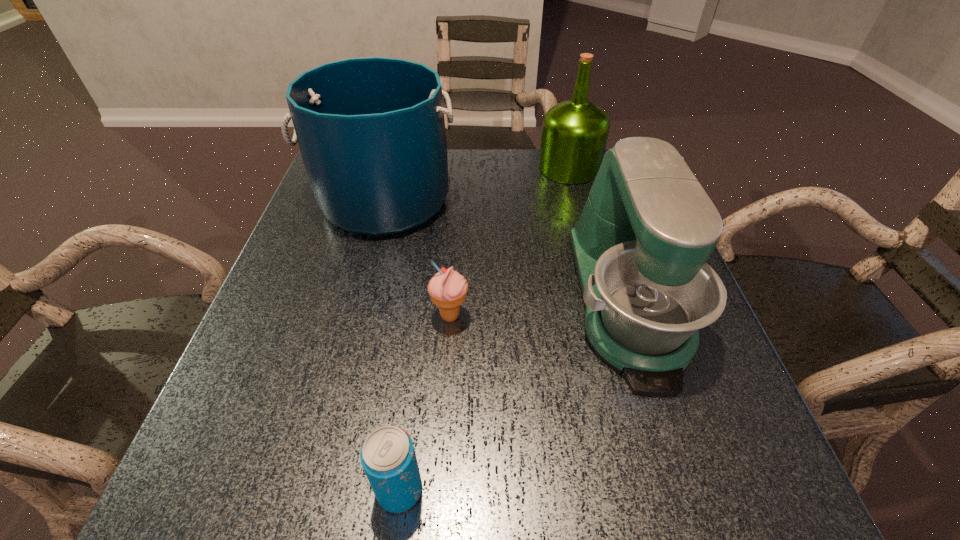
This screenshot has height=540, width=960. I want to click on olive oil that is at the far edge, so click(x=574, y=134).

The width and height of the screenshot is (960, 540). I want to click on bucket located at the far edge, so click(x=371, y=131).

Identify the location of object that is at the near edge. The height and width of the screenshot is (540, 960). click(388, 457).

The width and height of the screenshot is (960, 540). Find the location of `object situated at the left edge`. object situated at the left edge is located at coordinates (371, 131).

At what (x,y) coordinates should I click in order to perform the action: click on olive oil that is at the right edge. Please return your answer as a coordinate pair (x, y). Looking at the image, I should click on (574, 134).

Find the location of `mixer at the right edge`. mixer at the right edge is located at coordinates (640, 247).

The height and width of the screenshot is (540, 960). In order to click on object that is at the far left corner in this screenshot , I will do `click(371, 131)`.

At what (x,y) coordinates should I click in order to perform the action: click on object that is positioned at the far right corner. Please return your answer as a coordinate pair (x, y). Image resolution: width=960 pixels, height=540 pixels. Looking at the image, I should click on (574, 134).

Where is `free spot at the far edge of the desktop`? The height and width of the screenshot is (540, 960). free spot at the far edge of the desktop is located at coordinates (532, 156).

In the image, there is a desktop. At what (x,y) coordinates should I click in order to perform the action: click on blank space at the left edge. Please return your answer as a coordinate pair (x, y). Looking at the image, I should click on (321, 279).